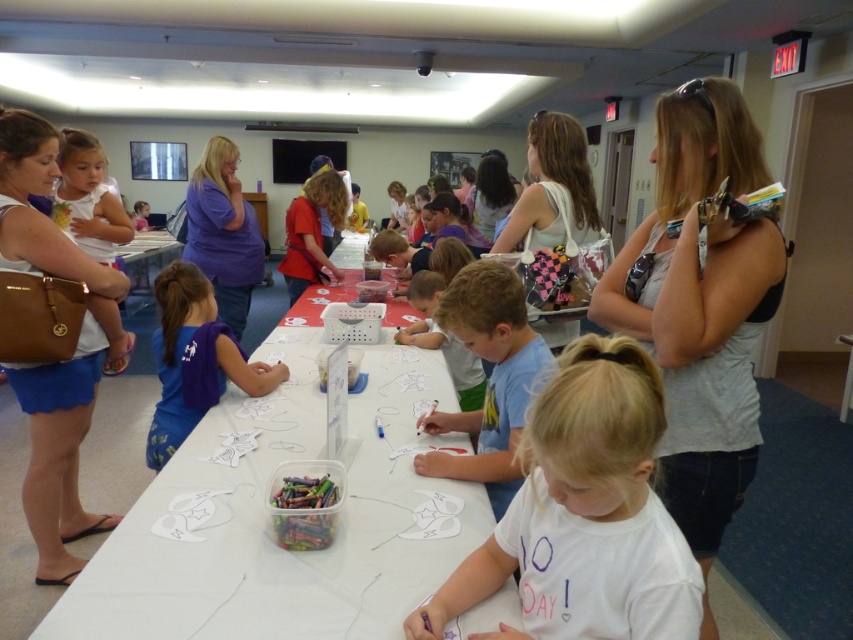
Can you confirm if white matte shirt at upper left is bigger than clear plastic table at center?

Incorrect, white matte shirt at upper left is not larger than clear plastic table at center.

Which is below, white matte shirt at upper left or clear plastic table at center?

Positioned lower is white matte shirt at upper left.

You are a GUI agent. You are given a task and a screenshot of the screen. Output one action in this format:
    pyautogui.click(x=<x>, y=<y>)
    Task: Click on the white matte shirt at upper left
    
    Given the screenshot: What is the action you would take?
    pyautogui.click(x=88, y=198)

Can you confirm if matte red shirt at center is wider than clear plastic table at center?

No.

Between matte red shirt at center and clear plastic table at center, which one is positioned lower?

Positioned lower is matte red shirt at center.

This screenshot has width=853, height=640. What do you see at coordinates (311, 232) in the screenshot? I see `matte red shirt at center` at bounding box center [311, 232].

The image size is (853, 640). I want to click on matte red shirt at center, so click(311, 232).

Who is more distant from viewer, (474,305) or (166,248)?

Point (166,248)

Identify the location of blue cotton shirt at center. (488, 378).

Find the location of a particular element. blue cotton shirt at center is located at coordinates (488, 378).